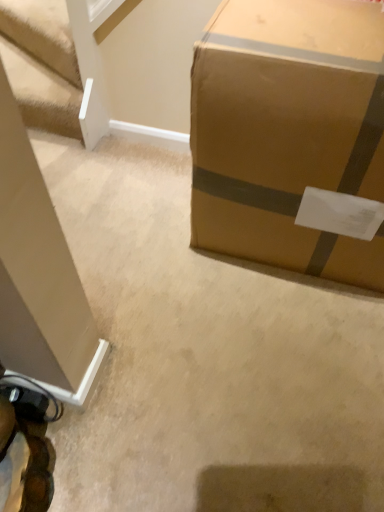
Locate an element on the screen. The image size is (384, 512). blank area to the left of brown cardboard box at right is located at coordinates (138, 232).